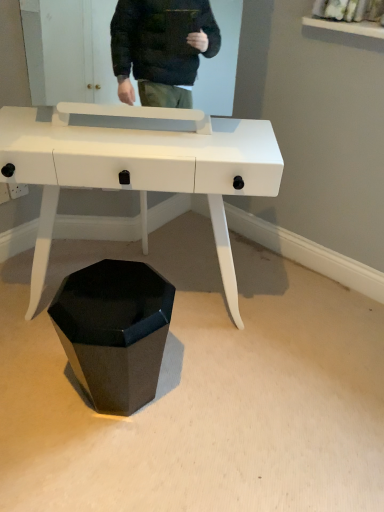
Identify the location of vacant area that lies to the right of white glossy desk at center. (304, 341).